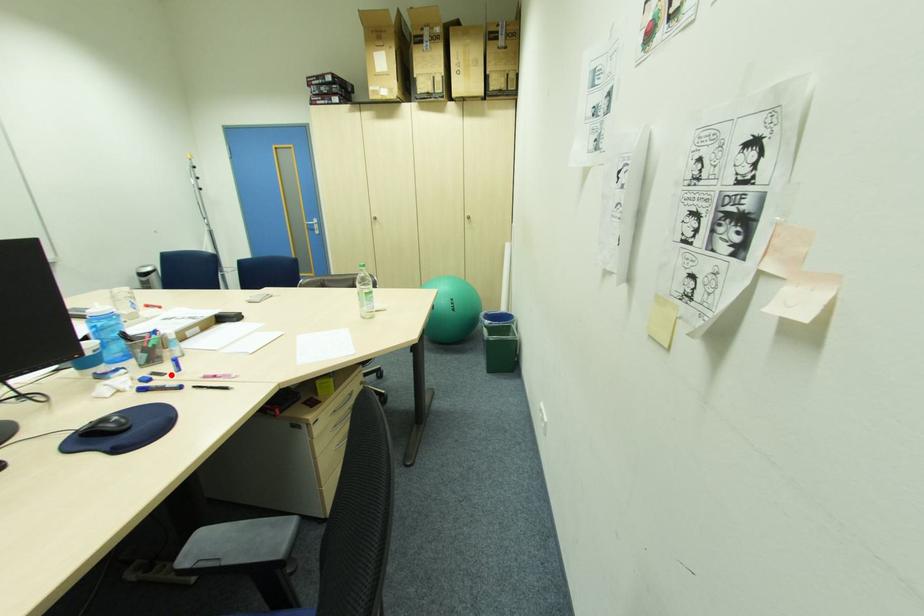
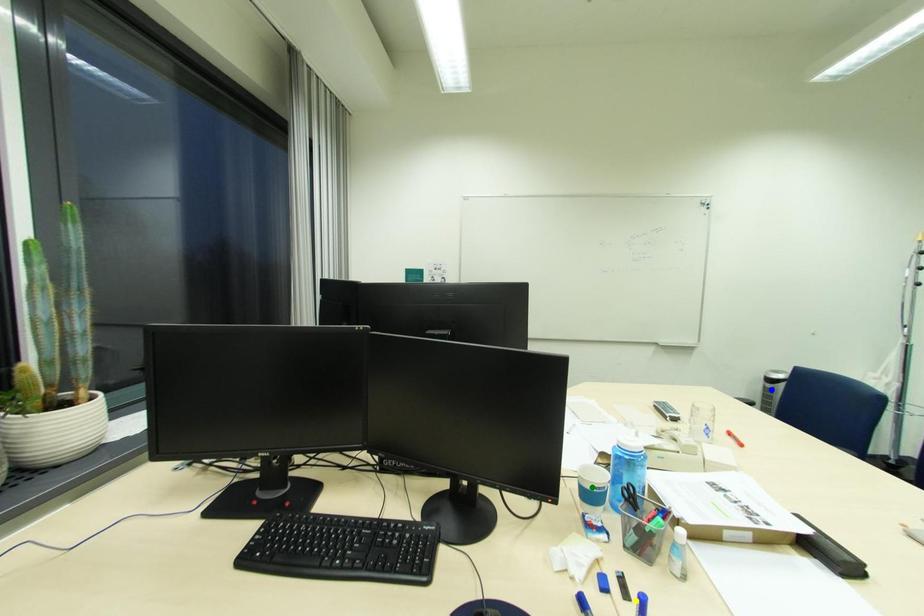
Question: I am providing you with two images of the same scene from different viewpoints. A red point is marked on the first image. You are given multiple points on the second image. Which mark in image 2 goes with the point in image 1?

Choices:
 (A) yellow point
 (B) green point
 (C) blue point

Answer: (A)